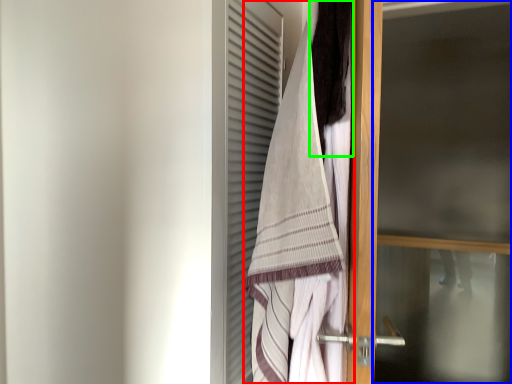
Question: Considering the real-world distances, which object is closest to towel (highlighted by a red box)? screen door (highlighted by a blue box) or hair (highlighted by a green box).

Choices:
 (A) screen door
 (B) hair

Answer: (B)